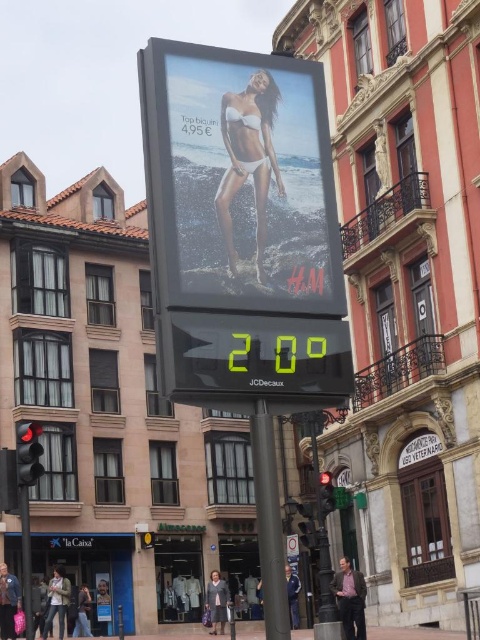
Question: Is white matte bikini at center in front of pink fabric shirt at lower center?

Choices:
 (A) no
 (B) yes

Answer: (B)

Question: Which of these objects is positioned closest to the metallic glossy poster at center?

Choices:
 (A) denim jacket at lower left
 (B) black metal pole at center
 (C) red glass traffic light at left
 (D) dark blue jeans at center

Answer: (B)

Question: Is metallic glossy poster at center in front of black metal pole at center?

Choices:
 (A) no
 (B) yes

Answer: (A)

Question: Which object appears closest to the camera in this image?

Choices:
 (A) black metal pole at center
 (B) blue fabric jacket at center

Answer: (A)

Question: Is black metal pole at center to the left of dark blue jeans at center from the viewer's perspective?

Choices:
 (A) yes
 (B) no

Answer: (B)

Question: Estimate the real-world distances between objects in this image. Which object is closer to the matte gray coat at center?

Choices:
 (A) pink fabric shirt at lower center
 (B) blue fabric jacket at center

Answer: (B)